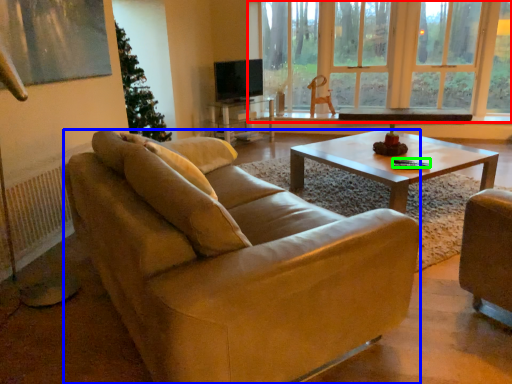
Question: Based on their relative distances, which object is farther from window (highlighted by a red box)? Choose from studio couch (highlighted by a blue box) and corded phone (highlighted by a green box).

Choices:
 (A) studio couch
 (B) corded phone

Answer: (A)